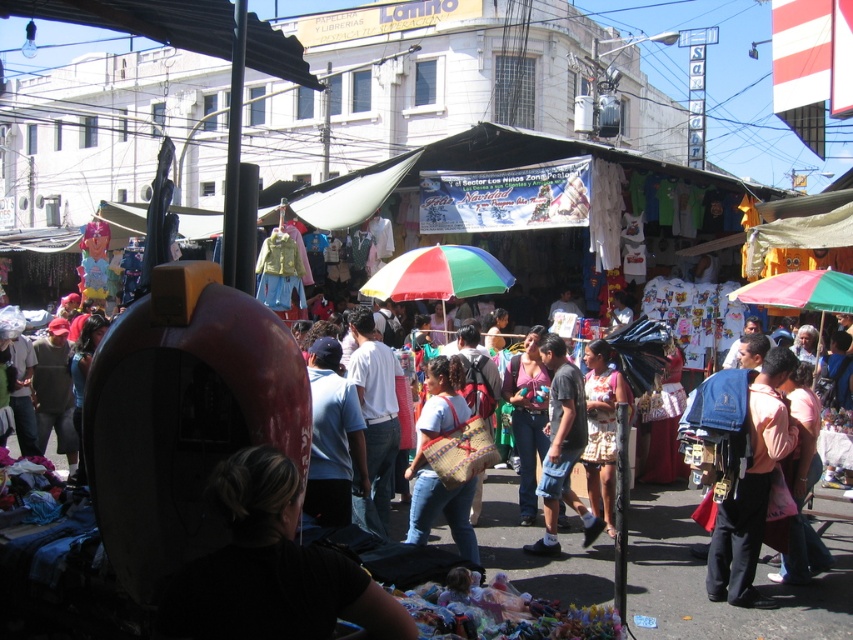
The image size is (853, 640). What do you see at coordinates (271, 566) in the screenshot?
I see `black fabric at lower center` at bounding box center [271, 566].

Which is more to the right, black fabric at lower center or woven fabric bag at center?

woven fabric bag at center is more to the right.

Image resolution: width=853 pixels, height=640 pixels. What do you see at coordinates (271, 566) in the screenshot?
I see `black fabric at lower center` at bounding box center [271, 566].

What are the coordinates of `black fabric at lower center` in the screenshot? It's located at (271, 566).

Consider the image. Is black fabric at lower center thinner than pink fabric backpack at lower right?

Incorrect, black fabric at lower center's width is not less than pink fabric backpack at lower right's.

Between point (375, 627) and point (744, 600), which one is positioned in front?

Point (375, 627) is in front.

This screenshot has height=640, width=853. I want to click on black fabric at lower center, so click(x=271, y=566).

Based on the photo, which of these two, light blue fabric shirt at center or printed cotton dress at center, stands shorter?

printed cotton dress at center is shorter.

Between light blue fabric shirt at center and printed cotton dress at center, which one has more height?

Standing taller between the two is light blue fabric shirt at center.

Is point (337, 449) in front of point (596, 381)?

Yes, it is.

Where is `light blue fabric shirt at center`? This screenshot has height=640, width=853. light blue fabric shirt at center is located at coordinates (334, 438).